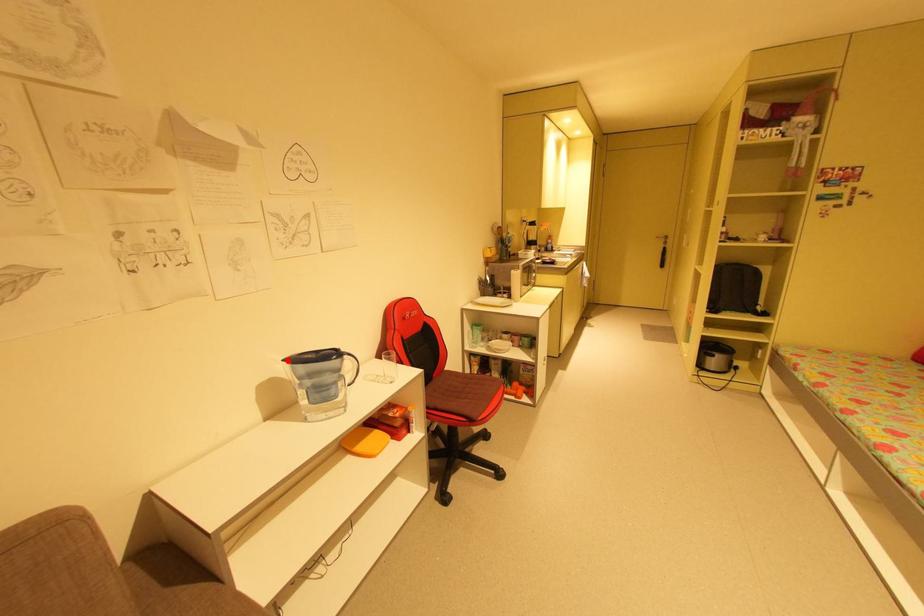
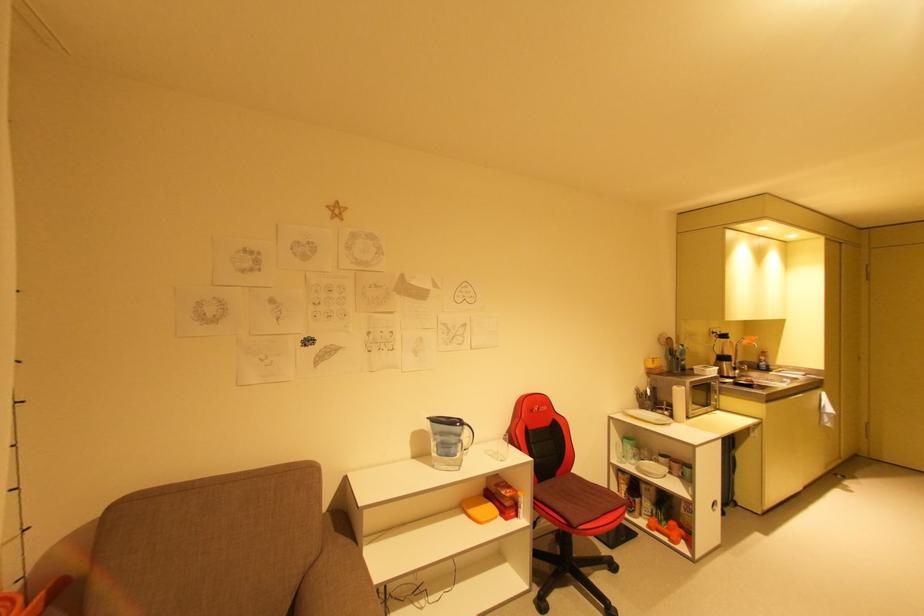
Question: I am providing you with two images of the same scene from different viewpoints. A red point is marked on the first image. Is the red point's position out of view in image 2?

Choices:
 (A) Yes
 (B) No

Answer: (B)